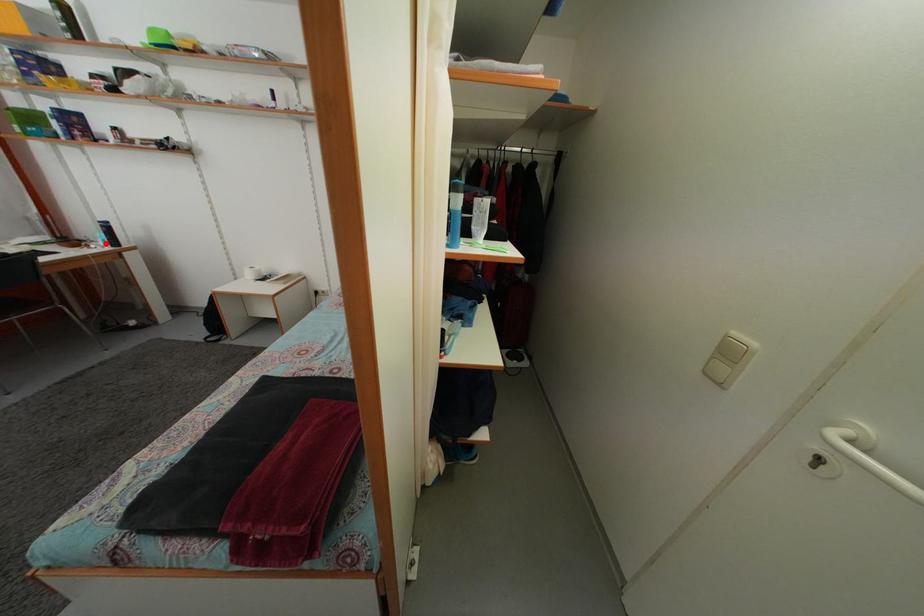
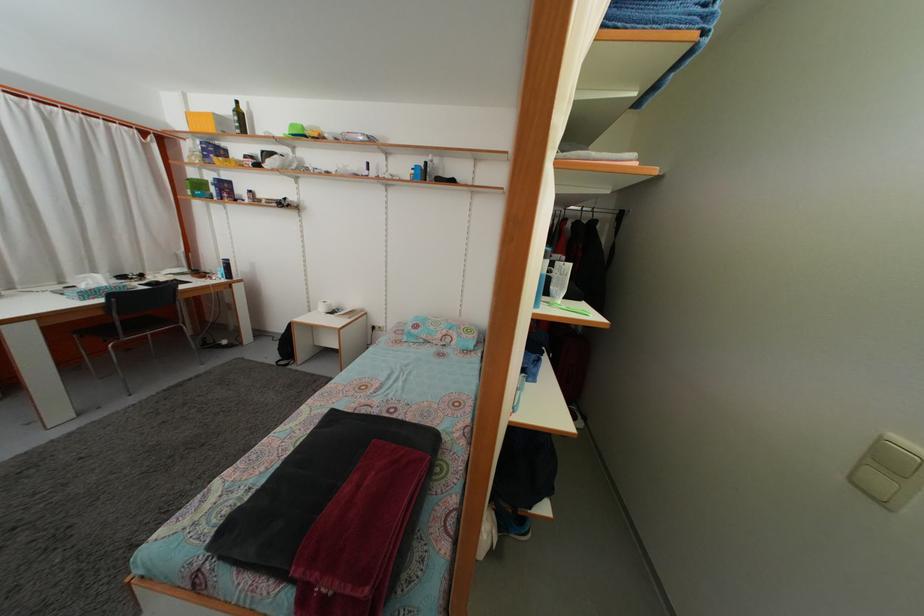
Where in the second image is the point corresponding to the highlighted location from the first image?

(226, 278)